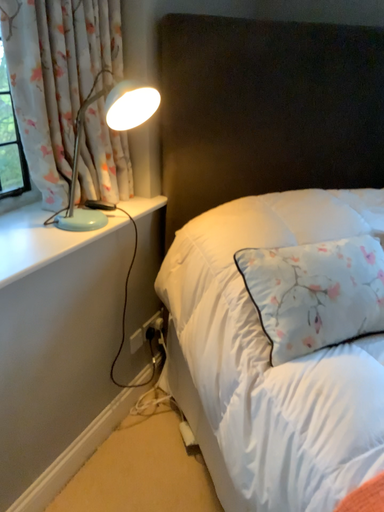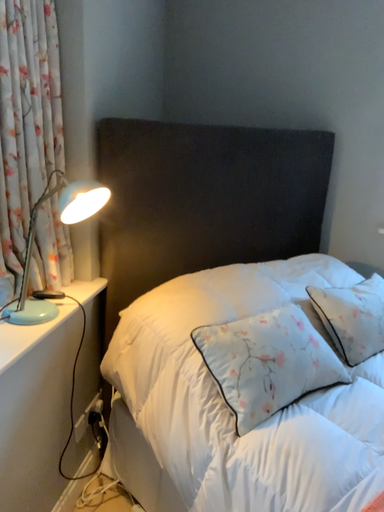
Question: Which way did the camera rotate in the video?

Choices:
 (A) rotated downward
 (B) rotated upward

Answer: (B)